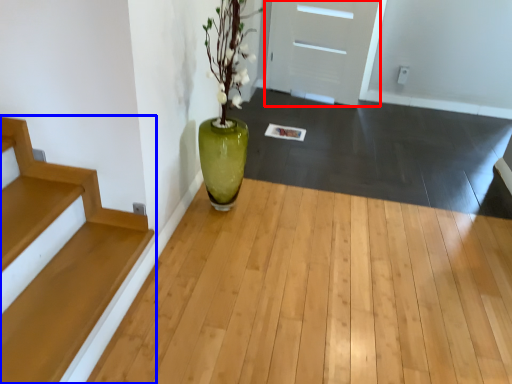
Question: Which object is further to the camera taking this photo, door (highlighted by a red box) or stairs (highlighted by a blue box)?

Choices:
 (A) door
 (B) stairs

Answer: (A)